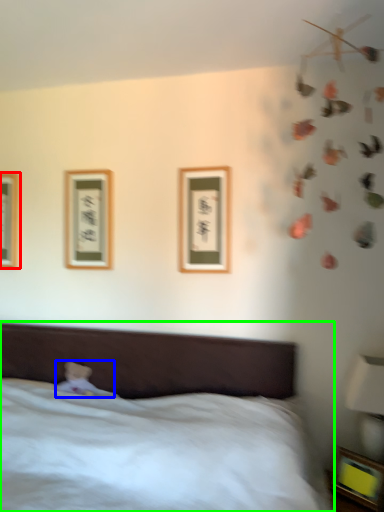
Question: Considering the real-world distances, which object is closest to picture frame (highlighted by a red box)? toy (highlighted by a blue box) or bed (highlighted by a green box).

Choices:
 (A) toy
 (B) bed

Answer: (A)